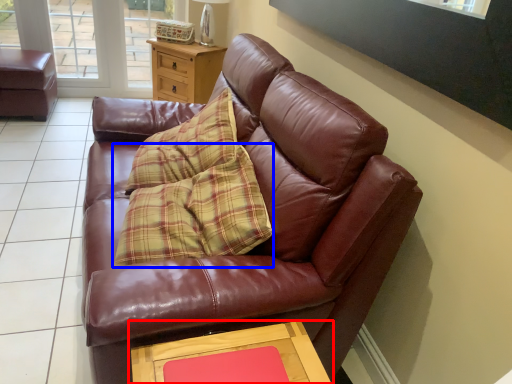
Question: Which object is further to the camera taking this photo, table (highlighted by a red box) or pillow (highlighted by a blue box)?

Choices:
 (A) table
 (B) pillow

Answer: (B)